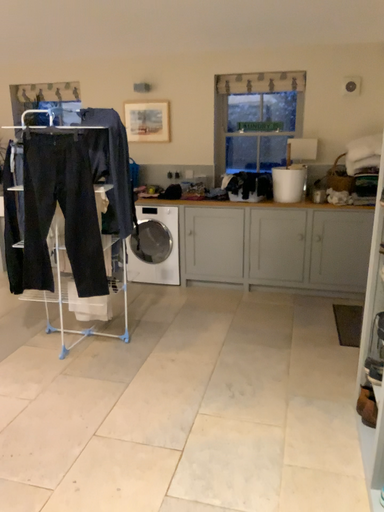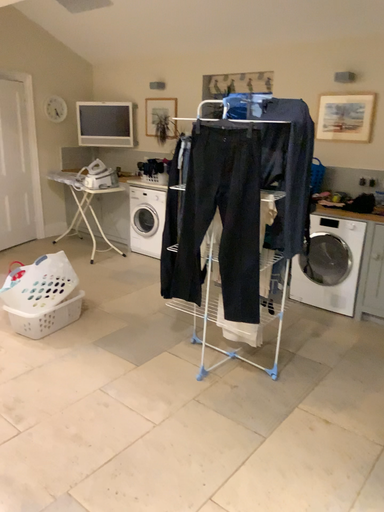
Question: Which way did the camera rotate in the video?

Choices:
 (A) rotated left
 (B) rotated right

Answer: (A)